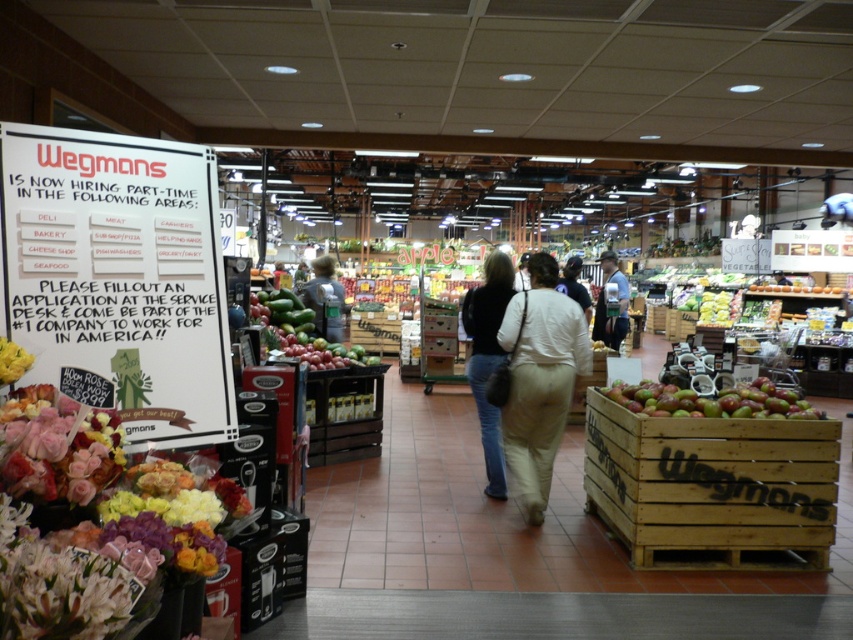
You are standing in the Wegmans grocery store and want to find the white paper sign at left. Where should you look?

You should look at point (119,278) to find the white paper sign at left.